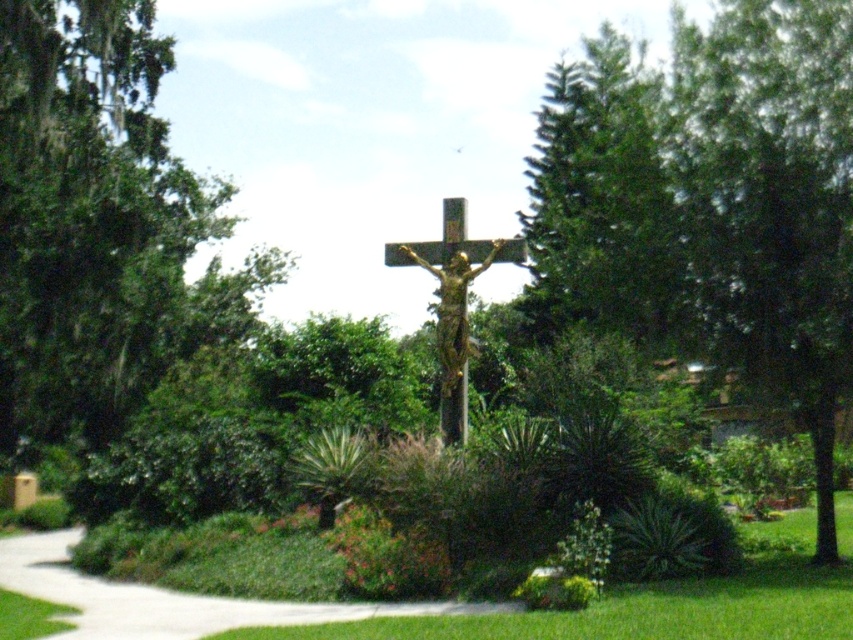
You are standing at the center of the scene looking towards the crucifixion statue. Which direction should you turn to face the green textured pine tree at upper right?

The green textured pine tree at upper right is located at point (602, 204), which is in the upper right direction from your current position at the center. Turn to your right and look upwards to face the green textured pine tree at upper right.

You are standing in front of the crucifixion statue in the garden. You notice two points marked in the scene. The first point is at coordinates point (648,634) and the second is at point (454,221). Which point is nearer to you?

Point (648,634) is closer to the viewer than point (454,221).